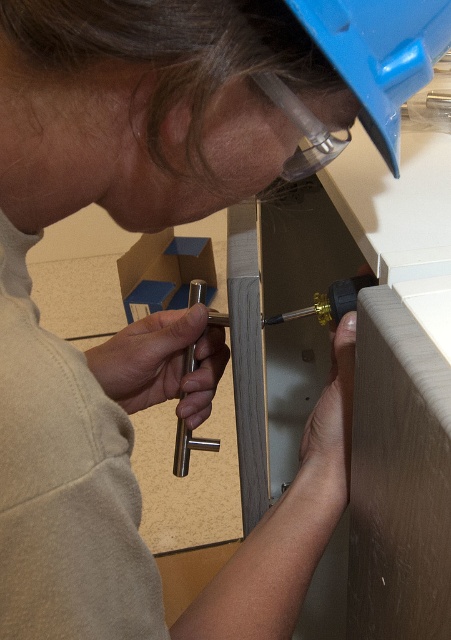
Question: Which of the following is the closest to the observer?

Choices:
 (A) (340, 54)
 (B) (179, 451)

Answer: (A)

Question: Is blue plastic helmet at upper center positioned behind gold metallic screwdriver at center?

Choices:
 (A) yes
 (B) no

Answer: (B)

Question: Is blue plastic helmet at upper center in front of gold metallic screwdriver at center?

Choices:
 (A) yes
 (B) no

Answer: (A)

Question: Is blue plastic helmet at upper center to the left of gold metallic screwdriver at center from the viewer's perspective?

Choices:
 (A) no
 (B) yes

Answer: (A)

Question: Which object is farther from the camera taking this photo?

Choices:
 (A) blue plastic helmet at upper center
 (B) gold metallic screwdriver at center

Answer: (B)